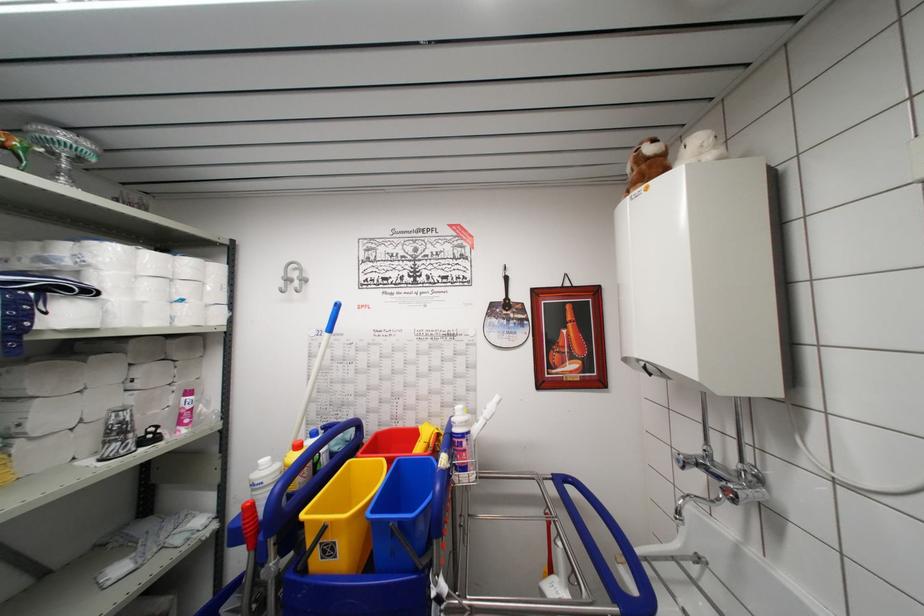
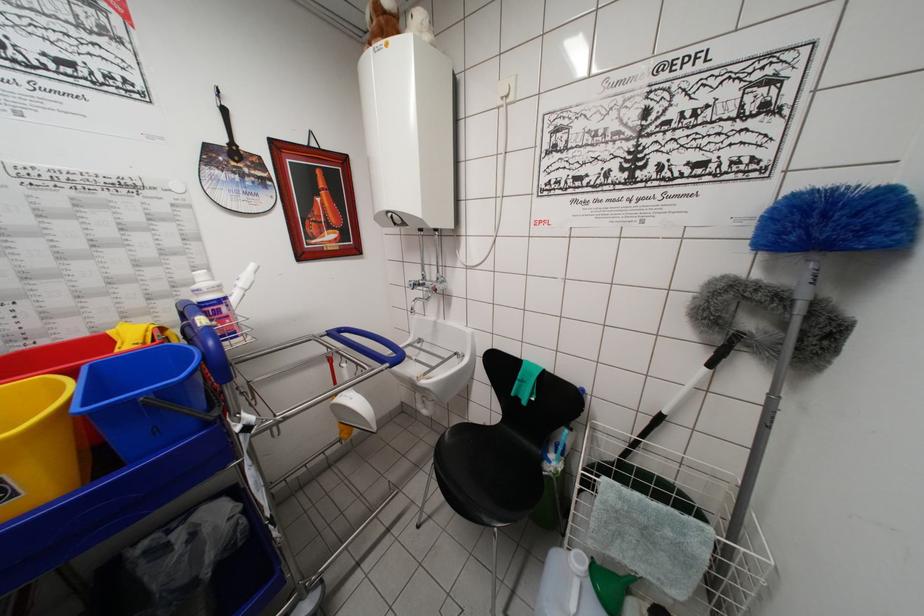
Where in the second image is the point corresponding to the point at 650,164 from the first image?

(387, 17)